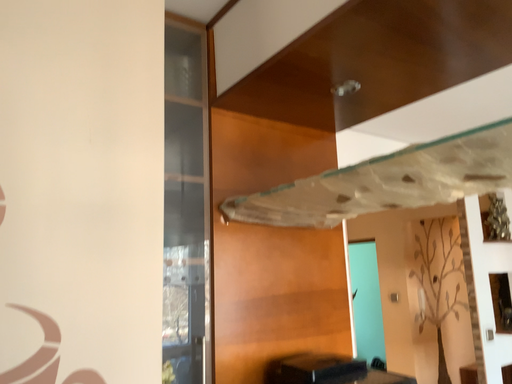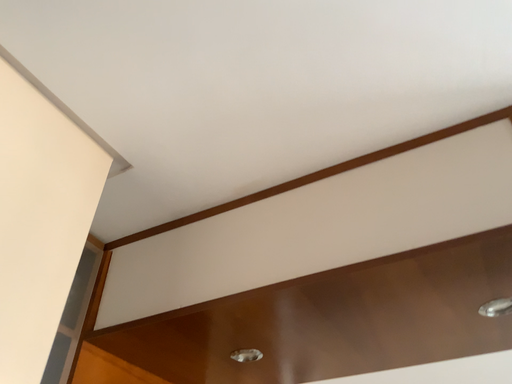
Question: How did the camera likely rotate when shooting the video?

Choices:
 (A) rotated left
 (B) rotated right

Answer: (B)